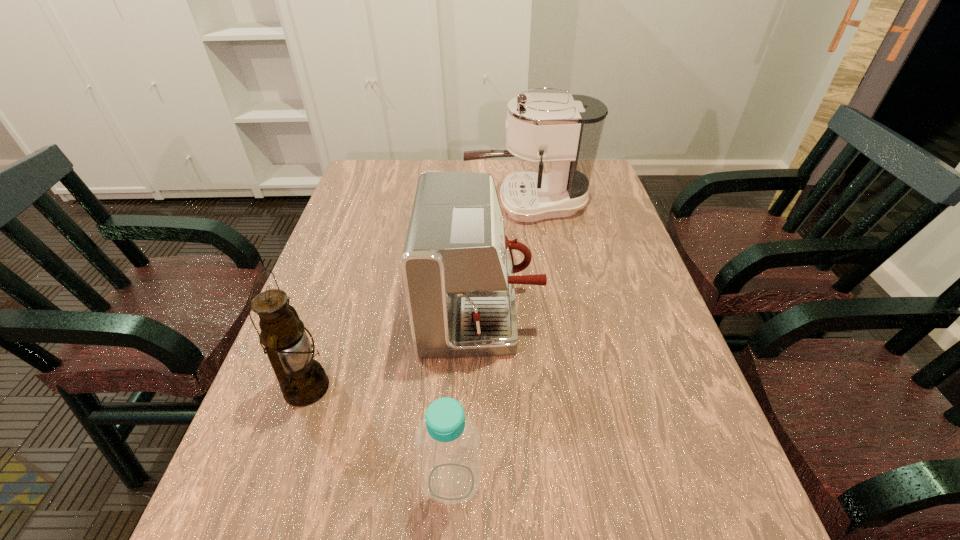
Locate an element on the screen. This screenshot has width=960, height=540. the farther coffee maker is located at coordinates tap(564, 130).

In order to click on the nearer coffee maker in this screenshot , I will do pos(457,264).

Image resolution: width=960 pixels, height=540 pixels. What are the coordinates of `oil lamp` in the screenshot? It's located at (303, 381).

The image size is (960, 540). In order to click on bottle in this screenshot , I will do click(449, 464).

Locate an element on the screen. This screenshot has height=540, width=960. the nearest object is located at coordinates (449, 464).

Identify the location of vacant space situated 0.100m on the front-facing side of the farthest object. (433, 204).

In order to click on free location located 0.380m on the front-facing side of the farthest object in this screenshot , I will do point(344,204).

You are a GUI agent. You are given a task and a screenshot of the screen. Output one action in this format:
    pyautogui.click(x=<x>, y=<y>)
    Task: Click on the free region located on the front-facing side of the farthest object
    Image resolution: width=960 pixels, height=540 pixels.
    Given the screenshot: What is the action you would take?
    pyautogui.click(x=370, y=204)

This screenshot has height=540, width=960. In order to click on vacant space located on the front of the nearer coffee maker near the spout in this screenshot , I will do `click(653, 312)`.

Find the location of a particular element. vacant space located on the right of the oil lamp is located at coordinates (449, 388).